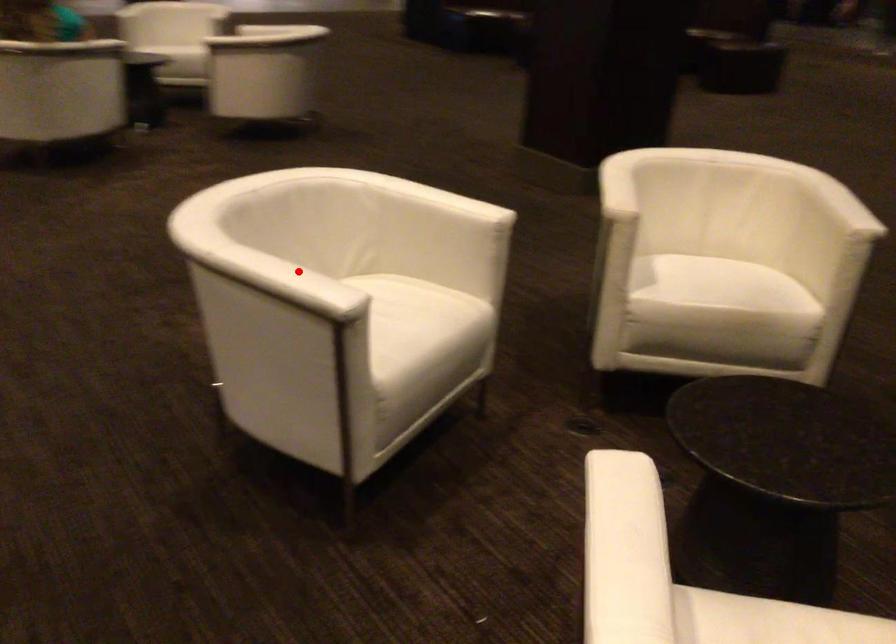
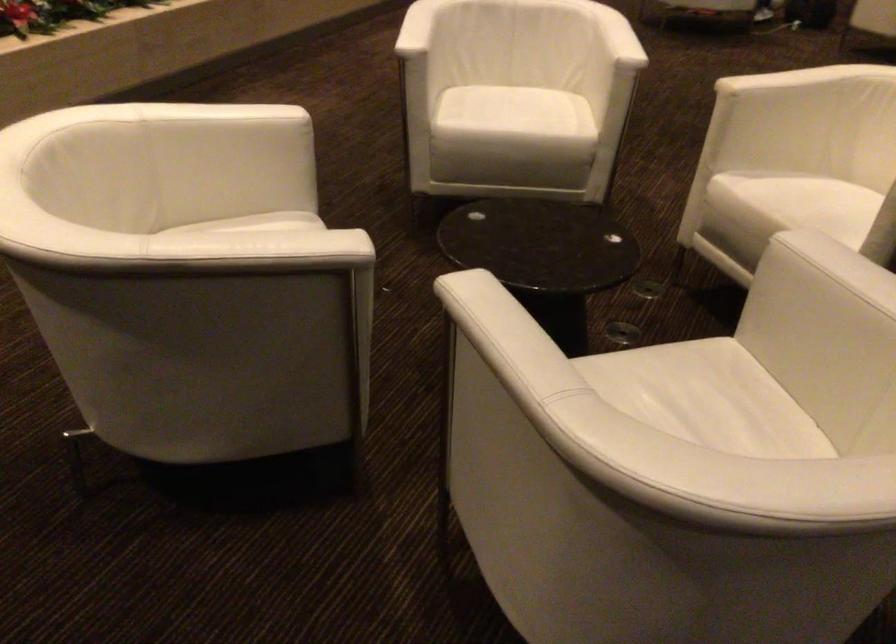
Question: I am providing you with two images of the same scene from different viewpoints. A red point is marked on the first image. At the location where the point appears in image 1, is it still visible in image 2?

Choices:
 (A) Yes
 (B) No

Answer: (A)